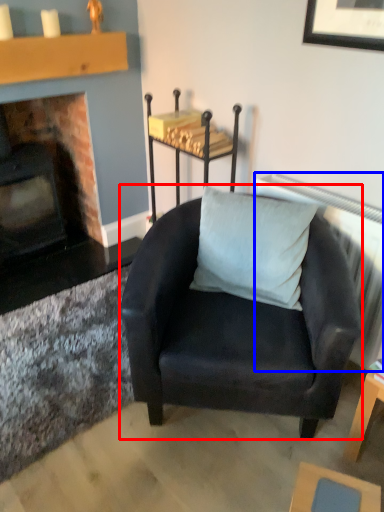
Question: Which of the following is the closest to the observer, chair (highlighted by a red box) or radiator (highlighted by a blue box)?

Choices:
 (A) chair
 (B) radiator

Answer: (A)